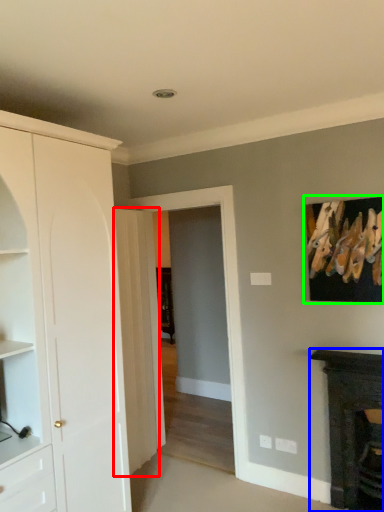
Question: Which object is positioned farthest from door (highlighted by a red box)? Select from fireplace (highlighted by a blue box) and picture frame (highlighted by a green box).

Choices:
 (A) fireplace
 (B) picture frame

Answer: (B)